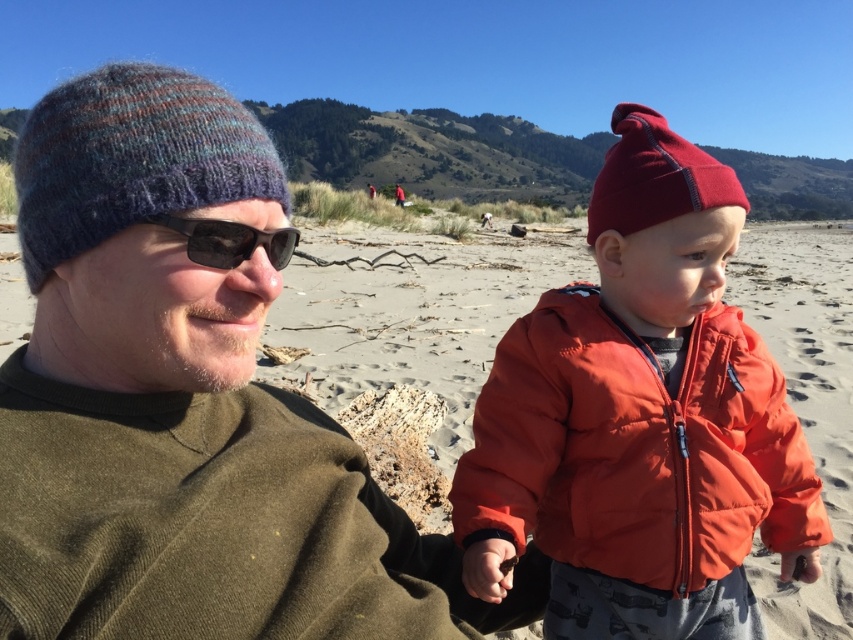
You are a photographer trying to capture both the matte red beanie at right and the matte red beanie at center in the same frame. Which beanie should you focus on first to ensure both are in the frame?

The matte red beanie at right is not as tall as the matte red beanie at center, so you should focus on the taller matte red beanie at center first to ensure both are in the frame.

You are a photographer trying to capture both the matte red beanie at right and the matte red beanie at center in a single frame. Considering their sizes, which one might appear smaller in the photo?

The matte red beanie at right has a lesser width compared to the matte red beanie at center, so it will appear smaller in the photo.